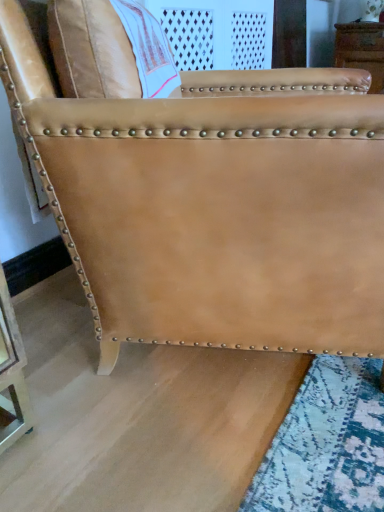
Question: From a real-world perspective, is tan leather chair at upper right positioned above or below tan leather chair at center?

Choices:
 (A) above
 (B) below

Answer: (A)

Question: Is point (334, 38) closer or farther from the camera than point (271, 193)?

Choices:
 (A) closer
 (B) farther

Answer: (B)

Question: Would you say tan leather chair at upper right is inside or outside tan leather chair at center?

Choices:
 (A) outside
 (B) inside

Answer: (A)

Question: Considering the positions of tan leather chair at center and tan leather chair at upper right in the image, is tan leather chair at center taller or shorter than tan leather chair at upper right?

Choices:
 (A) short
 (B) tall

Answer: (B)

Question: In terms of width, does tan leather chair at center look wider or thinner when compared to tan leather chair at upper right?

Choices:
 (A) wide
 (B) thin

Answer: (A)

Question: From the image's perspective, is tan leather chair at center located above or below tan leather chair at upper right?

Choices:
 (A) below
 (B) above

Answer: (A)

Question: From a real-world perspective, relative to tan leather chair at upper right, is tan leather chair at center vertically above or below?

Choices:
 (A) above
 (B) below

Answer: (B)